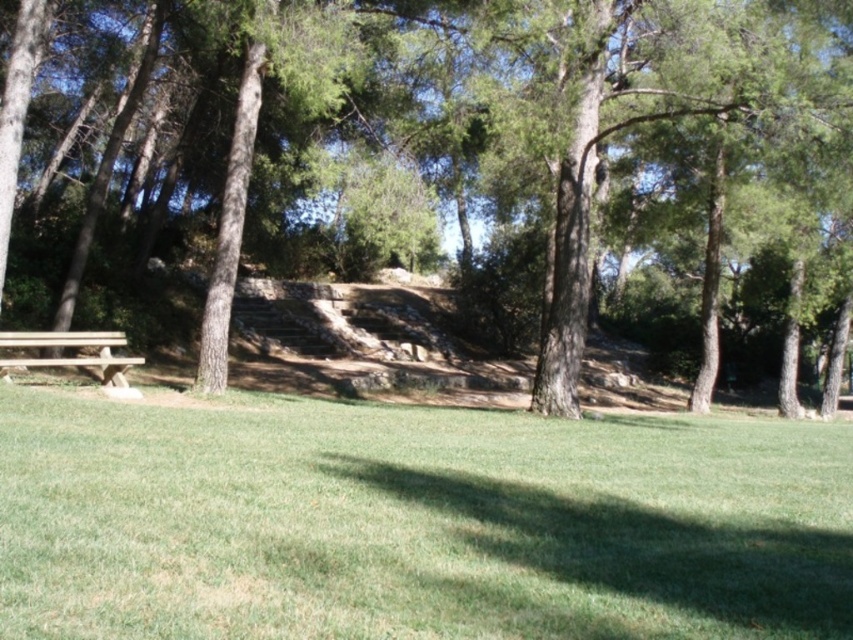
Question: Is green grass at lower center in front of brown textured tree at left?

Choices:
 (A) no
 (B) yes

Answer: (B)

Question: Does green grass at lower center lie behind wooden bench at lower left?

Choices:
 (A) yes
 (B) no

Answer: (B)

Question: Which of these objects is positioned closest to the brown textured tree at left?

Choices:
 (A) green grass at lower center
 (B) wooden bench at lower left

Answer: (A)

Question: Is green grass at lower center wider than brown textured tree at left?

Choices:
 (A) no
 (B) yes

Answer: (A)

Question: Estimate the real-world distances between objects in this image. Which object is farther from the green grass at lower center?

Choices:
 (A) wooden bench at lower left
 (B) brown textured tree at left

Answer: (B)

Question: Which of the following is the closest to the observer?

Choices:
 (A) (218, 506)
 (B) (523, 326)
 (C) (115, 385)

Answer: (A)